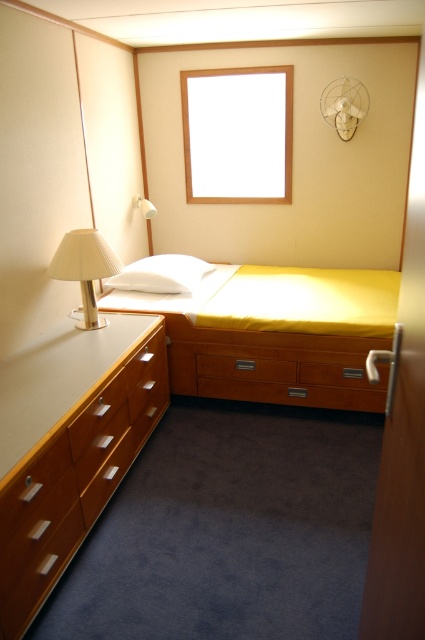
Can you confirm if matte wood drawer at lower left is positioned below white soft pillow at center?

Yes.

Is point (31, 499) closer to viewer compared to point (132, 262)?

Yes.

You are a GUI agent. You are given a task and a screenshot of the screen. Output one action in this format:
    pyautogui.click(x=<x>, y=<y>)
    Task: Click on the matte wood drawer at lower left
    
    Given the screenshot: What is the action you would take?
    pyautogui.click(x=36, y=532)

Does transparent glass window at upper center appear on the left side of white soft pillow at center?

No, transparent glass window at upper center is not to the left of white soft pillow at center.

Does transparent glass window at upper center have a larger size compared to white soft pillow at center?

Yes, transparent glass window at upper center is bigger than white soft pillow at center.

This screenshot has height=640, width=425. What do you see at coordinates (238, 134) in the screenshot? I see `transparent glass window at upper center` at bounding box center [238, 134].

Where is `transparent glass window at upper center`? The image size is (425, 640). transparent glass window at upper center is located at coordinates (238, 134).

Does point (47, 515) come behind point (139, 198)?

No, it is in front of (139, 198).

Between matte wood drawer at lower left and white matte lampshade at upper left, which one has less height?

white matte lampshade at upper left

Who is more distant from viewer, [19,612] or [147,205]?

Positioned behind is point [147,205].

Locate an element on the screen. The width and height of the screenshot is (425, 640). matte wood drawer at lower left is located at coordinates (36, 532).